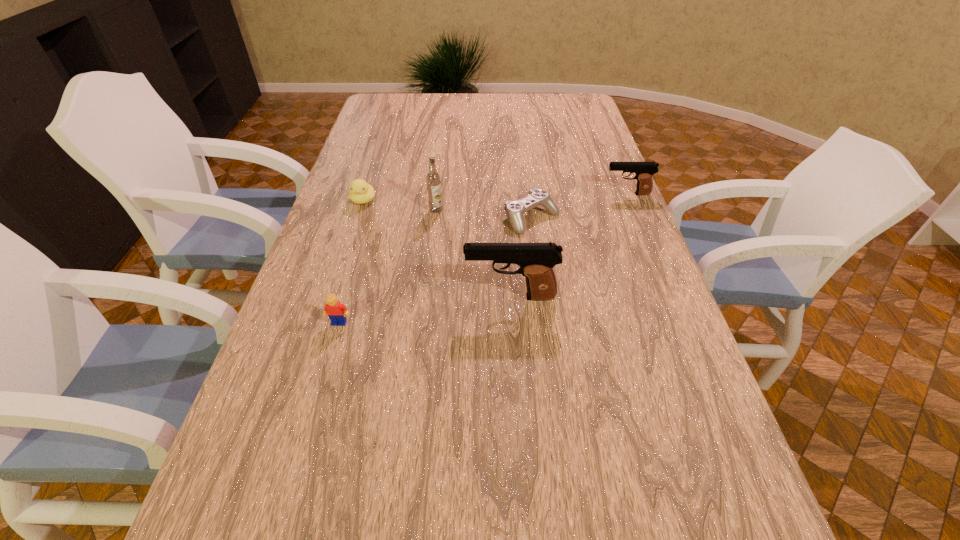
Choose which object is the second nearest neighbor to the fifth tallest object. Please provide its 2D coordinates. Your answer should be formatted as a tuple, i.e. [(x, y)], where the tuple contains the x and y coordinates of a point satisfying the conditions above.

[(514, 210)]

The width and height of the screenshot is (960, 540). Identify the location of free location that satisfies the following two spatial constraints: 1. at the barrel of the farther pistol; 2. at the beak of the duckling. (630, 200).

The height and width of the screenshot is (540, 960). I want to click on vacant region that satisfies the following two spatial constraints: 1. at the beak of the shortest object; 2. on the right side of the duckling, so click(x=357, y=219).

You are a GUI agent. You are given a task and a screenshot of the screen. Output one action in this format:
    pyautogui.click(x=<x>, y=<y>)
    Task: Click on the vacant area in the image that satisfies the following two spatial constraints: 1. at the beak of the shortest object; 2. on the left side of the duckling
    
    Given the screenshot: What is the action you would take?
    pyautogui.click(x=357, y=219)